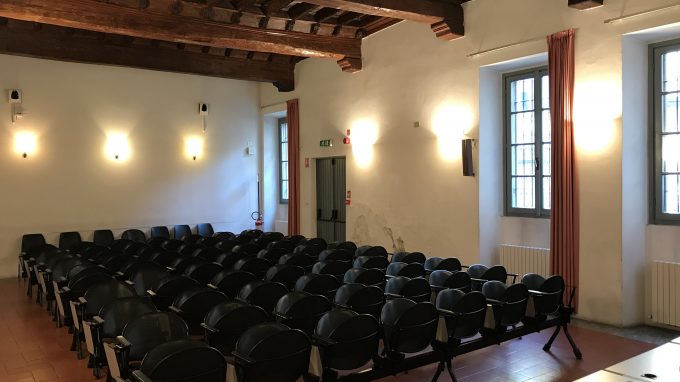
The height and width of the screenshot is (382, 680). I want to click on cord, so click(621, 368).